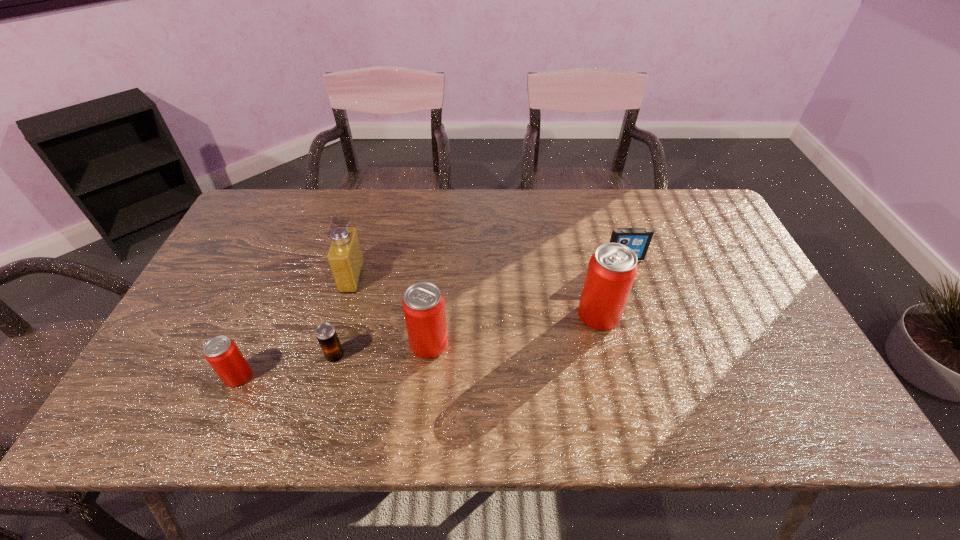
Where is `vacant area that lies between the beer can and the leftmost can`? Image resolution: width=960 pixels, height=540 pixels. vacant area that lies between the beer can and the leftmost can is located at coordinates (287, 366).

Where is `object that stands as the third closest to the fourth object from left to right`? object that stands as the third closest to the fourth object from left to right is located at coordinates (611, 271).

Select which object is the second closest to the third object from right to left. Please provide its 2D coordinates. Your answer should be formatted as a tuple, i.e. [(x, y)], where the tuple contains the x and y coordinates of a point satisfying the conditions above.

[(345, 257)]

In order to click on the second closest can to the rightmost can in this screenshot , I will do `click(222, 353)`.

What are the coordinates of `can that is the nearest to the fifth nearest object` in the screenshot? It's located at (423, 304).

At what (x,y) coordinates should I click in order to perform the action: click on free space that satisfies the following two spatial constraints: 1. on the front-facing side of the fifth nearest object; 2. on the back side of the rightmost can. Please return your answer as a coordinate pair (x, y). This screenshot has height=540, width=960. Looking at the image, I should click on (342, 315).

The image size is (960, 540). Find the location of `free spot that satisfies the following two spatial constraints: 1. on the front-facing side of the second object from right to left; 2. on the right side of the perfume`. free spot that satisfies the following two spatial constraints: 1. on the front-facing side of the second object from right to left; 2. on the right side of the perfume is located at coordinates (342, 315).

Locate an element on the screen. free space that satisfies the following two spatial constraints: 1. on the back side of the second object from right to left; 2. on the left side of the second shortest can is located at coordinates (432, 315).

Locate an element on the screen. vacant space that satisfies the following two spatial constraints: 1. on the front-facing side of the second can from left to right; 2. on the right side of the fifth nearest object is located at coordinates (333, 344).

This screenshot has width=960, height=540. Find the location of `vacant point that satisfies the following two spatial constraints: 1. on the back side of the fifth object from left to right; 2. on the left side of the leftmost can`. vacant point that satisfies the following two spatial constraints: 1. on the back side of the fifth object from left to right; 2. on the left side of the leftmost can is located at coordinates (265, 315).